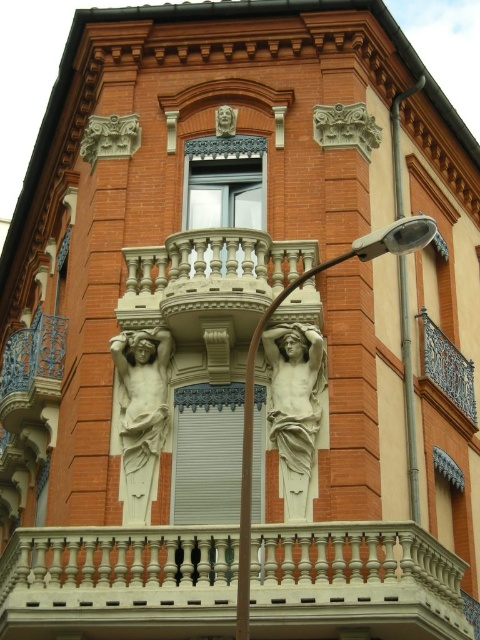
Question: Which of the following is the closest to the observer?

Choices:
 (A) (157, 392)
 (B) (373, 234)
 (C) (319, 529)

Answer: (B)

Question: Does white marble balustrade at center have a greater width compared to white marble statue at left?

Choices:
 (A) no
 (B) yes

Answer: (B)

Question: Which of the following is the farthest from the observer?

Choices:
 (A) white marble statue at center
 (B) matte stone face at upper center
 (C) white marble statue at left
 (D) white marble balustrade at center

Answer: (B)

Question: Among these points, which one is farthest from the camera?

Choices:
 (A) (124, 509)
 (B) (408, 228)
 (C) (222, 131)

Answer: (C)

Question: Is white marble statue at center to the left of white marble statue at left from the viewer's perspective?

Choices:
 (A) no
 (B) yes

Answer: (A)

Question: Can you confirm if white marble statue at center is positioned to the left of white marble statue at left?

Choices:
 (A) no
 (B) yes

Answer: (A)